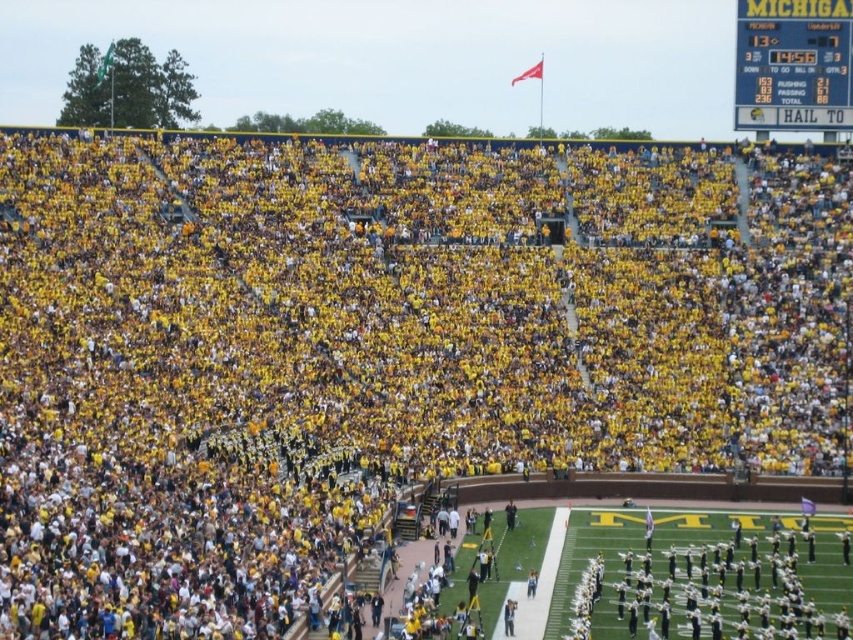
You are a photographer at the stadium and want to capture a wide shot of the white uniformed band at lower right and the yellow plastic scoreboard at upper right in the same frame. Given their widths, which object should you position closer to the center of the frame to ensure both fit properly?

The white uniformed band at lower right is wider than the yellow plastic scoreboard at upper right. To ensure both fit in the frame, position the white uniformed band at lower right closer to the center since it is wider and requires more space.

You are a drone operator tasked with capturing aerial footage of the white uniformed band at lower right during the halftime show. The drone has a maximum flight range of 250 feet. Can you safely fly the drone from your current position to the band and return without exceeding the drone range limit?

The white uniformed band at lower right is 231.92 feet away from the viewer. Since the round trip distance would be 463.84 feet, which exceeds the drone maximum flight range of 250 feet, the drone cannot safely reach the band and return without exceeding the range limit.

You are a photographer at the stadium and want to capture a photo of the white uniformed band at lower right. You are currently standing at the point marked at point (706,577). Can you take a clear photo of the band without any obstructions?

The white uniformed band at lower right is located at point (706,577), so you are standing right where the band is. Move to a different location to get a clear view.